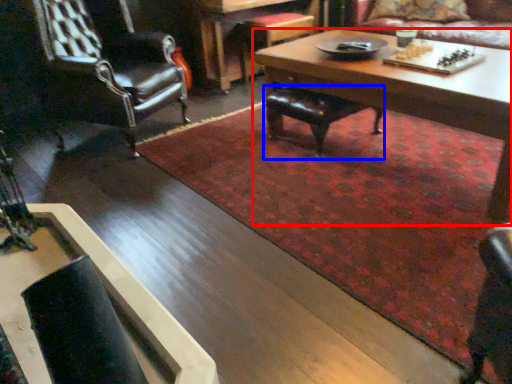
Question: Among these objects, which one is farthest to the camera, coffee table (highlighted by a red box) or chair (highlighted by a blue box)?

Choices:
 (A) coffee table
 (B) chair

Answer: (B)